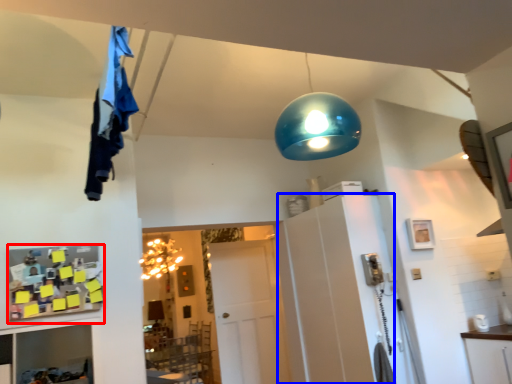
Question: Which point is further to the camera, shelf (highlighted by a red box) or cabinetry (highlighted by a blue box)?

Choices:
 (A) shelf
 (B) cabinetry

Answer: (B)